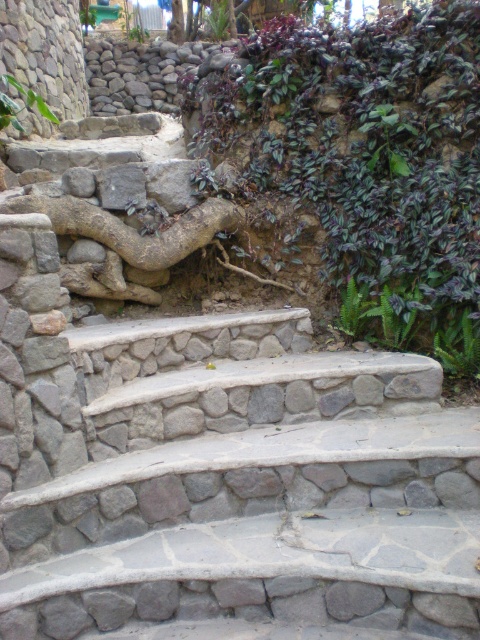
Question: Does natural stone stairs at center have a larger size compared to purple leafy plant at upper right?

Choices:
 (A) yes
 (B) no

Answer: (B)

Question: Among these objects, which one is nearest to the camera?

Choices:
 (A) purple leafy plant at upper right
 (B) brown rough tree root at center
 (C) rough stone wall at upper left
 (D) green leafy plant at lower right

Answer: (A)

Question: Which of these objects is positioned closest to the rough stone wall at upper left?

Choices:
 (A) green leafy plant at lower right
 (B) natural stone stairs at center
 (C) brown rough tree root at center

Answer: (C)

Question: Can you confirm if rough stone wall at upper left is positioned to the right of green leafy plant at lower right?

Choices:
 (A) no
 (B) yes

Answer: (A)

Question: Considering the real-world distances, which object is closest to the natural stone stairs at center?

Choices:
 (A) purple leafy plant at upper right
 (B) rough stone wall at upper left
 (C) brown rough tree root at center

Answer: (A)

Question: Does brown rough tree root at center lie behind green leafy plant at lower right?

Choices:
 (A) yes
 (B) no

Answer: (A)